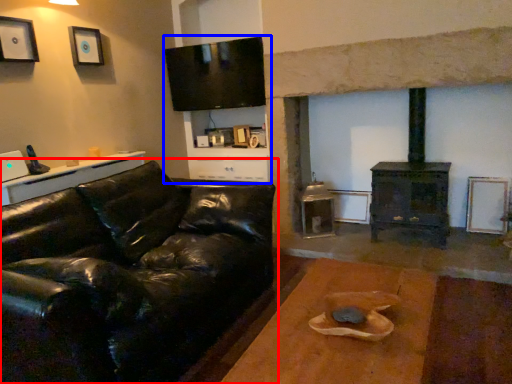
Question: Which of the following is the farthest to the observer, studio couch (highlighted by a red box) or entertainment center (highlighted by a blue box)?

Choices:
 (A) studio couch
 (B) entertainment center

Answer: (B)